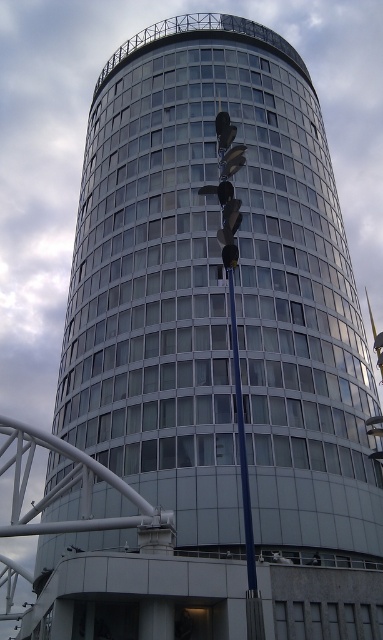
Question: Which point appears farthest from the camera in this image?

Choices:
 (A) (232, 316)
 (B) (314, 563)

Answer: (A)

Question: Is blue metallic pole at center above dark blue fabric mannequin at center?

Choices:
 (A) no
 (B) yes

Answer: (B)

Question: Does blue metallic pole at center come behind dark blue fabric mannequin at center?

Choices:
 (A) yes
 (B) no

Answer: (B)

Question: Does blue metallic pole at center appear on the right side of dark blue fabric mannequin at center?

Choices:
 (A) no
 (B) yes

Answer: (A)